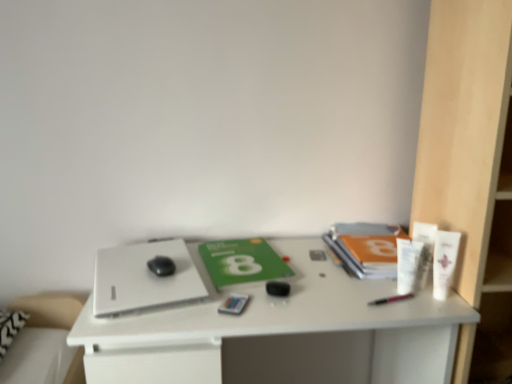
Where is `free space in front of matte plastic card at center, which appears as the first stationery when viewed from the left`? This screenshot has width=512, height=384. free space in front of matte plastic card at center, which appears as the first stationery when viewed from the left is located at coordinates (229, 324).